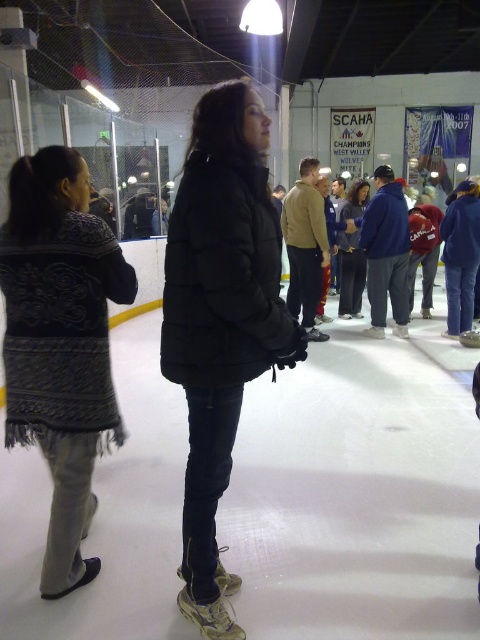
You are a photographer at the event and want to capture a photo of both the dark gray knitted sweater at left and the matte black jacket at center. Which object should you focus on first if you want to ensure both are in sharp focus?

You should focus on the dark gray knitted sweater at left first because it is taller than the matte black jacket at center, allowing the depth of field to cover both subjects effectively.

You are a photographer at the indoor ice rink. You need to capture a photo that includes both the black puffer jacket at center and the dark gray knitted sweater at left. Which of these two items should you adjust your camera focus to first to ensure both are in the frame?

The black puffer jacket at center is located above the dark gray knitted sweater at left, so you should focus on the black puffer jacket at center first to ensure both are in the frame.